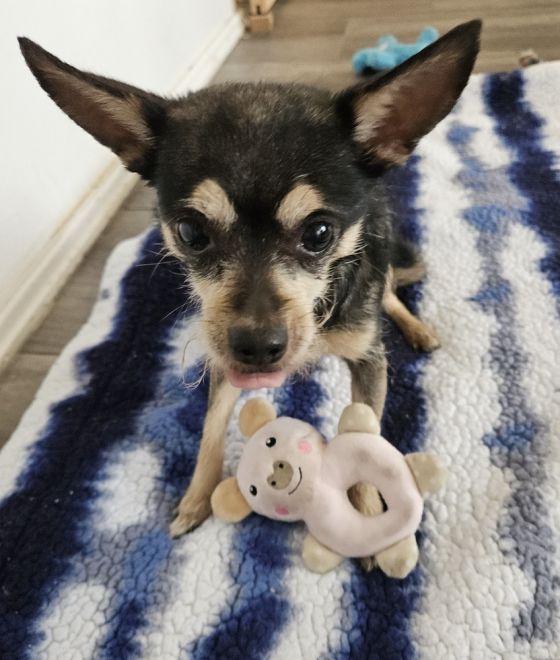
Locate an element on the screen. Image resolution: width=560 pixels, height=660 pixels. rug is located at coordinates (487, 457).